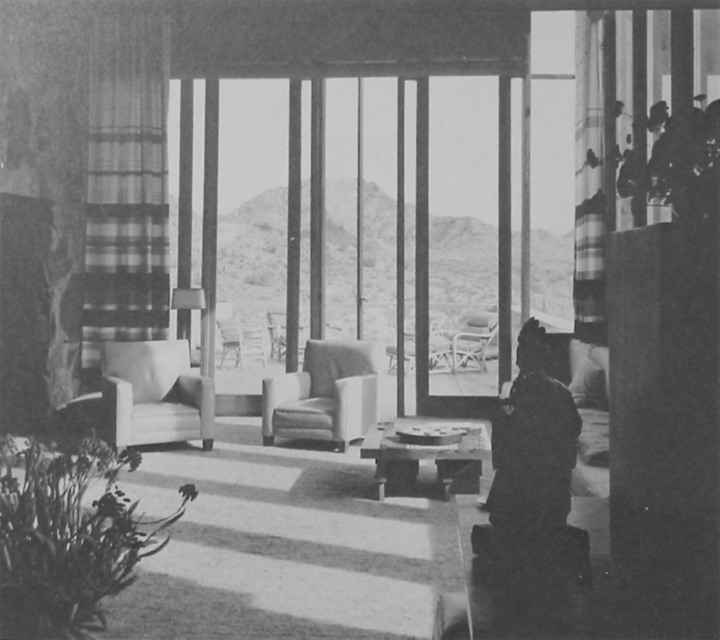
You are a visitor in this room and want to place a small potted plant on the wooden coffee table at center. Considering the height of the metallic silver chair at center, will the plant be visible to someone sitting on the chair?

The wooden coffee table at center is not as tall as the metallic silver chair at center, so the plant placed on the wooden coffee table at center will be visible to someone sitting on the metallic silver chair at center.

You are planning to place a large rectangular plant pot that measures 1.2 meters in length on the wooden coffee table at center or the smooth leather chair at center. Based on the scene description, which object can accommodate the plant pot without it hanging over the edges?

The wooden coffee table at center has a larger size compared to the smooth leather chair at center, so the wooden coffee table at center can accommodate the plant pot without it hanging over the edges.

You are standing in the room and want to pick up a book from the wooden coffee table at center and then sit down on the smooth leather chair at center. Which object will you encounter first when moving towards the chair?

You will encounter the wooden coffee table at center first because it is closer to you than the smooth leather chair at center.